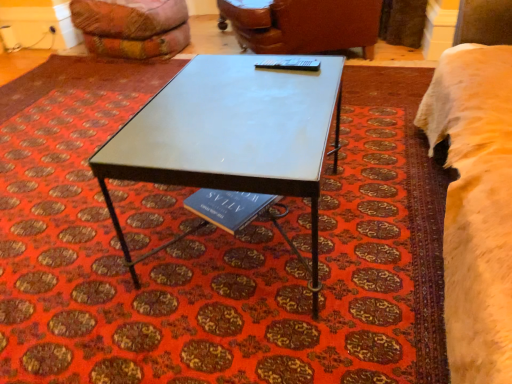
Identify the location of vacant space to the right of metallic gray table at center. The width and height of the screenshot is (512, 384). (376, 200).